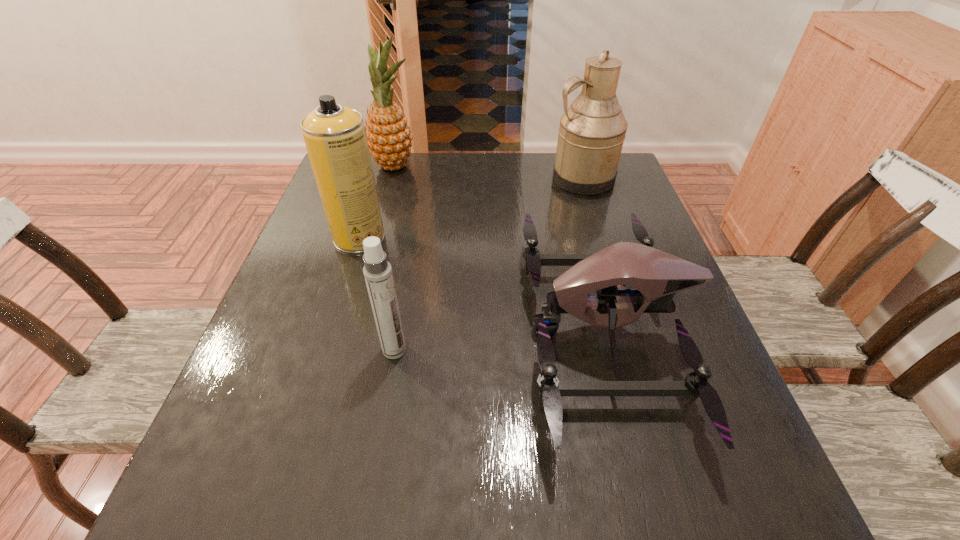
This screenshot has width=960, height=540. In order to click on vacant space that's between the shorter aerosol can and the pitcher in this screenshot , I will do `click(489, 264)`.

This screenshot has width=960, height=540. Identify the location of free space between the pineapple and the nearer aerosol can. (395, 258).

You are a GUI agent. You are given a task and a screenshot of the screen. Output one action in this format:
    pyautogui.click(x=<x>, y=<y>)
    Task: Click on the free spot between the pineapple and the shortest object
    
    Given the screenshot: What is the action you would take?
    pyautogui.click(x=499, y=249)

The width and height of the screenshot is (960, 540). In order to click on free area in between the pitcher and the farther aerosol can in this screenshot , I will do `click(470, 208)`.

Choose which object is the fourth nearest neighbor to the pineapple. Please provide its 2D coordinates. Your answer should be formatted as a tuple, i.e. [(x, y)], where the tuple contains the x and y coordinates of a point satisfying the conditions above.

[(377, 271)]

At what (x,y) coordinates should I click in order to perform the action: click on object that is the nearest to the pitcher. Please return your answer as a coordinate pair (x, y). Looking at the image, I should click on (656, 276).

Image resolution: width=960 pixels, height=540 pixels. What are the coordinates of `free location that satisfies the following two spatial constraints: 1. on the front side of the pitcher; 2. on the right side of the pineapple` in the screenshot? It's located at (391, 178).

You are a GUI agent. You are given a task and a screenshot of the screen. Output one action in this format:
    pyautogui.click(x=<x>, y=<y>)
    Task: Click on the vacant space that satisfies the following two spatial constraints: 1. on the back side of the taller aerosol can; 2. on the right side of the pineapple
    
    Given the screenshot: What is the action you would take?
    pyautogui.click(x=381, y=166)

You are a GUI agent. You are given a task and a screenshot of the screen. Output one action in this format:
    pyautogui.click(x=<x>, y=<y>)
    Task: Click on the vacant space that satisfies the following two spatial constraints: 1. on the front side of the pineapple; 2. on the right side of the shorter aerosol can
    
    Given the screenshot: What is the action you would take?
    pyautogui.click(x=345, y=350)

In order to click on free space in the image that satisfies the following two spatial constraints: 1. on the front-facing side of the shortest object; 2. on the front side of the nearer aerosol can in this screenshot , I will do `click(610, 350)`.